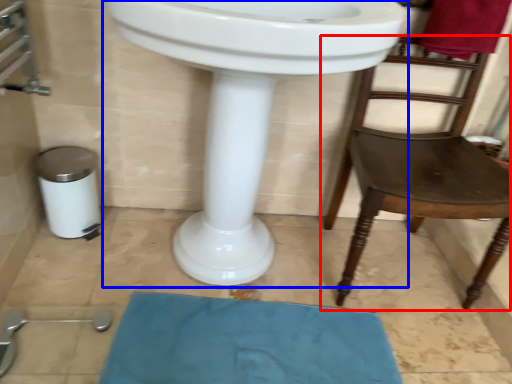
Question: Which point is further to the camera, chair (highlighted by a red box) or sink (highlighted by a blue box)?

Choices:
 (A) chair
 (B) sink

Answer: (A)